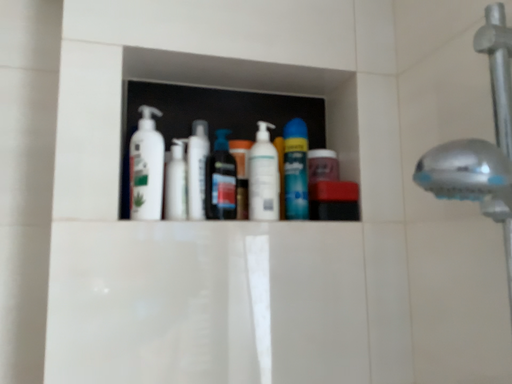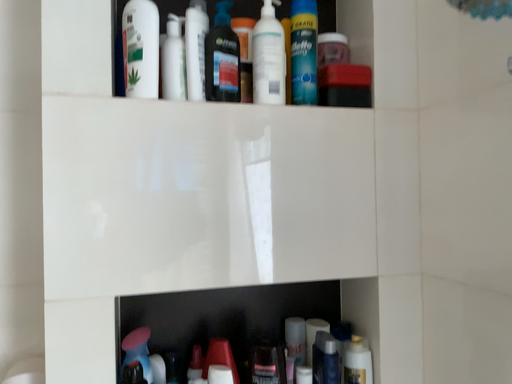
Question: Which way did the camera rotate in the video?

Choices:
 (A) rotated upward
 (B) rotated downward

Answer: (B)